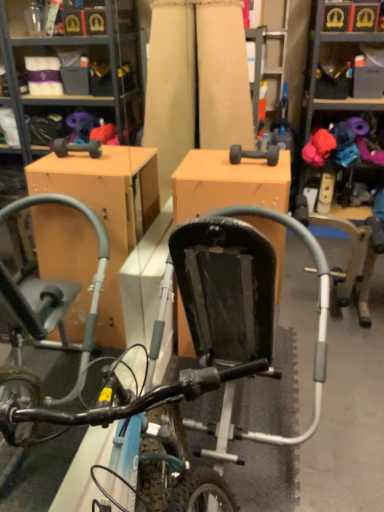
Locate an element on the screen. Image resolution: width=384 pixels, height=512 pixels. black matte bicycle at center is located at coordinates (196, 336).

Describe the element at coordinates (196, 336) in the screenshot. I see `black matte bicycle at center` at that location.

At what (x,y) coordinates should I click in order to perform the action: click on black matte bicycle at center. Please return your answer as a coordinate pair (x, y). This screenshot has height=512, width=384. Looking at the image, I should click on (196, 336).